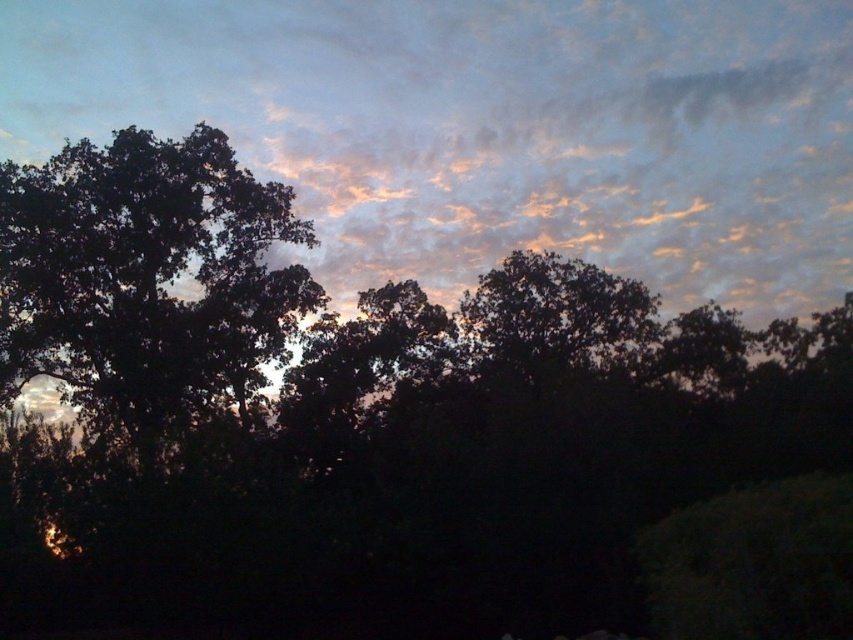
Question: Which of the following is the farthest from the observer?

Choices:
 (A) (834, 253)
 (B) (7, 164)

Answer: (A)

Question: Is matte orange cloud at upper center further to the viewer compared to dark green leafy tree at left?

Choices:
 (A) yes
 (B) no

Answer: (A)

Question: Does matte orange cloud at upper center come in front of dark green leafy tree at left?

Choices:
 (A) no
 (B) yes

Answer: (A)

Question: Can you confirm if matte orange cloud at upper center is bigger than dark green leafy tree at left?

Choices:
 (A) yes
 (B) no

Answer: (A)